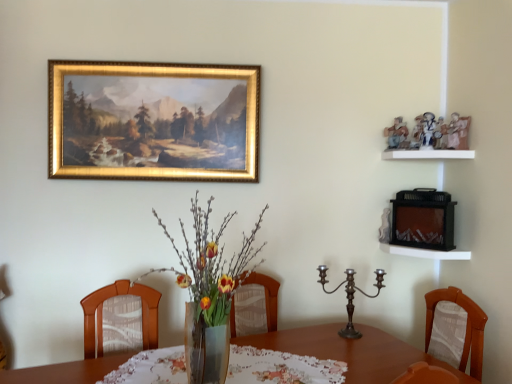
Identify the location of printed fabric tablecloth at center. (280, 368).

Describe the element at coordinates (426, 154) in the screenshot. This screenshot has height=384, width=512. I see `white matte shelf at upper right, positioned as the 1th shelf in top-to-bottom order` at that location.

The width and height of the screenshot is (512, 384). What do you see at coordinates (425, 252) in the screenshot? I see `white wooden shelf at right, which ranks as the second shelf in top-to-bottom order` at bounding box center [425, 252].

Identify the location of translucent glass vase at center. (209, 293).

In the image, is translucent glass vase at center positioned in front of or behind white matte shelf at upper right, positioned as the 1th shelf in top-to-bottom order?

Visually, translucent glass vase at center is located in front of white matte shelf at upper right, positioned as the 1th shelf in top-to-bottom order.

Find the location of a particular element. The height and width of the screenshot is (384, 512). floral arrangement below the white matte shelf at upper right, the 2th shelf when ordered from bottom to top (from a real-world perspective) is located at coordinates (209, 293).

Considering the positions of point (191, 296) and point (423, 153), is point (191, 296) closer or farther from the camera than point (423, 153)?

Point (191, 296) appears to be closer to the viewer than point (423, 153).

Is translucent glass vase at center looking in the opposite direction of white matte shelf at upper right, the 2th shelf when ordered from bottom to top?

translucent glass vase at center does not have its back to white matte shelf at upper right, the 2th shelf when ordered from bottom to top.

Is translucent glass vase at center bigger than printed fabric tablecloth at center?

Yes.

From a real-world perspective, between translucent glass vase at center and printed fabric tablecloth at center, who is vertically lower?

printed fabric tablecloth at center, from a real-world perspective.

Is printed fabric tablecloth at center with white matte shelf at upper right, positioned as the 1th shelf in top-to-bottom order?

No, printed fabric tablecloth at center is not making contact with white matte shelf at upper right, positioned as the 1th shelf in top-to-bottom order.

In the scene shown: Which object is further away from the camera taking this photo, printed fabric tablecloth at center or white matte shelf at upper right, the 2th shelf when ordered from bottom to top?

Positioned behind is white matte shelf at upper right, the 2th shelf when ordered from bottom to top.

How many degrees apart are the facing directions of printed fabric tablecloth at center and white matte shelf at upper right, positioned as the 1th shelf in top-to-bottom order?

The angular difference between printed fabric tablecloth at center and white matte shelf at upper right, positioned as the 1th shelf in top-to-bottom order, is 68.6 degrees.

Locate an element on the screen. This screenshot has height=384, width=512. tablecloth below the white matte shelf at upper right, positioned as the 1th shelf in top-to-bottom order (from the image's perspective) is located at coordinates (280, 368).

Which of these two, printed fabric tablecloth at center or translucent glass vase at center, is wider?

translucent glass vase at center.

Considering the sizes of objects printed fabric tablecloth at center and translucent glass vase at center in the image provided, who is shorter, printed fabric tablecloth at center or translucent glass vase at center?

With less height is printed fabric tablecloth at center.

From the image's perspective, which is above, printed fabric tablecloth at center or translucent glass vase at center?

translucent glass vase at center is shown above in the image.

From the image's perspective, is white matte shelf at upper right, the 2th shelf when ordered from bottom to top, above or below translucent glass vase at center?

Clearly, from the image's perspective, white matte shelf at upper right, the 2th shelf when ordered from bottom to top, is above translucent glass vase at center.

Is white matte shelf at upper right, positioned as the 1th shelf in top-to-bottom order, with translucent glass vase at center?

No, white matte shelf at upper right, positioned as the 1th shelf in top-to-bottom order, is not making contact with translucent glass vase at center.

Consider the image. Does white matte shelf at upper right, the 2th shelf when ordered from bottom to top, appear on the left side of translucent glass vase at center?

In fact, white matte shelf at upper right, the 2th shelf when ordered from bottom to top, is to the right of translucent glass vase at center.

Which object is further away from the camera taking this photo, white matte shelf at upper right, positioned as the 1th shelf in top-to-bottom order, or translucent glass vase at center?

white matte shelf at upper right, positioned as the 1th shelf in top-to-bottom order, is further away from the camera.

How many degrees apart are the facing directions of polished bronze candelabra at center and white matte shelf at upper right, positioned as the 1th shelf in top-to-bottom order?

polished bronze candelabra at center and white matte shelf at upper right, positioned as the 1th shelf in top-to-bottom order, are facing 80.4 degrees away from each other.

From the image's perspective, which one is positioned lower, polished bronze candelabra at center or white matte shelf at upper right, the 2th shelf when ordered from bottom to top?

polished bronze candelabra at center is shown below in the image.

Can you confirm if polished bronze candelabra at center is shorter than white matte shelf at upper right, the 2th shelf when ordered from bottom to top?

In fact, polished bronze candelabra at center may be taller than white matte shelf at upper right, the 2th shelf when ordered from bottom to top.

Looking at this image, considering the relative sizes of polished bronze candelabra at center and white matte shelf at upper right, the 2th shelf when ordered from bottom to top, in the image provided, is polished bronze candelabra at center wider than white matte shelf at upper right, the 2th shelf when ordered from bottom to top,?

No, polished bronze candelabra at center is not wider than white matte shelf at upper right, the 2th shelf when ordered from bottom to top.

Looking at this image, would you say polished bronze candelabra at center is part of white wooden shelf at right, the first shelf when ordered from bottom to top,'s contents?

No, polished bronze candelabra at center is not a part of white wooden shelf at right, the first shelf when ordered from bottom to top.

Which is behind, point (423, 254) or point (353, 330)?

The point (423, 254) is farther from the camera.

How different are the orientations of white wooden shelf at right, which ranks as the second shelf in top-to-bottom order, and polished bronze candelabra at center in degrees?

There is a 80.4-degree angle between the facing directions of white wooden shelf at right, which ranks as the second shelf in top-to-bottom order, and polished bronze candelabra at center.

Does white wooden shelf at right, which ranks as the second shelf in top-to-bottom order, turn towards polished bronze candelabra at center?

No, white wooden shelf at right, which ranks as the second shelf in top-to-bottom order, is not turned towards polished bronze candelabra at center.

Which shelf is the 2nd one when counting from the right side of the translucent glass vase at center? Please provide its 2D coordinates.

[(426, 154)]

At what (x,y) coordinates should I click in order to perform the action: click on tablecloth behind the translucent glass vase at center. Please return your answer as a coordinate pair (x, y). Looking at the image, I should click on (280, 368).

From the image, which object appears to be nearer to polished bronze candelabra at center, printed fabric tablecloth at center or white wooden shelf at right, which ranks as the second shelf in top-to-bottom order?

white wooden shelf at right, which ranks as the second shelf in top-to-bottom order, lies closer to polished bronze candelabra at center than the other object.

Looking at the image, which one is located closer to white wooden shelf at right, which ranks as the second shelf in top-to-bottom order, gold-framed painting at upper center or printed fabric tablecloth at center?

Among the two, printed fabric tablecloth at center is located nearer to white wooden shelf at right, which ranks as the second shelf in top-to-bottom order.

Looking at the image, which one is located closer to white wooden shelf at right, the first shelf when ordered from bottom to top, polished bronze candelabra at center or white matte shelf at upper right, positioned as the 1th shelf in top-to-bottom order?

Based on the image, polished bronze candelabra at center appears to be nearer to white wooden shelf at right, the first shelf when ordered from bottom to top.

Considering their positions, is gold-framed painting at upper center positioned closer to white matte shelf at upper right, positioned as the 1th shelf in top-to-bottom order, than printed fabric tablecloth at center?

Among the two, gold-framed painting at upper center is located nearer to white matte shelf at upper right, positioned as the 1th shelf in top-to-bottom order.

Considering their positions, is printed fabric tablecloth at center positioned closer to gold-framed painting at upper center than polished bronze candelabra at center?

Based on the image, printed fabric tablecloth at center appears to be nearer to gold-framed painting at upper center.

When comparing their distances from gold-framed painting at upper center, does white matte shelf at upper right, the 2th shelf when ordered from bottom to top, or white wooden shelf at right, the first shelf when ordered from bottom to top, seem closer?

Among the two, white matte shelf at upper right, the 2th shelf when ordered from bottom to top, is located nearer to gold-framed painting at upper center.

In the scene shown: Estimate the real-world distances between objects in this image. Which object is closer to white matte shelf at upper right, the 2th shelf when ordered from bottom to top, translucent glass vase at center or printed fabric tablecloth at center?

The object closer to white matte shelf at upper right, the 2th shelf when ordered from bottom to top, is translucent glass vase at center.

Considering their positions, is gold-framed painting at upper center positioned further to translucent glass vase at center than printed fabric tablecloth at center?

gold-framed painting at upper center lies further to translucent glass vase at center than the other object.

In order to click on tablecloth between translucent glass vase at center and white wooden shelf at right, which ranks as the second shelf in top-to-bottom order, from left to right in this screenshot , I will do `click(280, 368)`.

This screenshot has height=384, width=512. I want to click on tablecloth between translucent glass vase at center and gold-framed painting at upper center in the front-back direction, so click(x=280, y=368).

Identify the location of shelf situated between printed fabric tablecloth at center and white matte shelf at upper right, positioned as the 1th shelf in top-to-bottom order, from left to right. (425, 252).

Find the location of `tablecloth between gold-framed painting at upper center and white wooden shelf at right, which ranks as the second shelf in top-to-bottom order`. tablecloth between gold-framed painting at upper center and white wooden shelf at right, which ranks as the second shelf in top-to-bottom order is located at coordinates (280, 368).